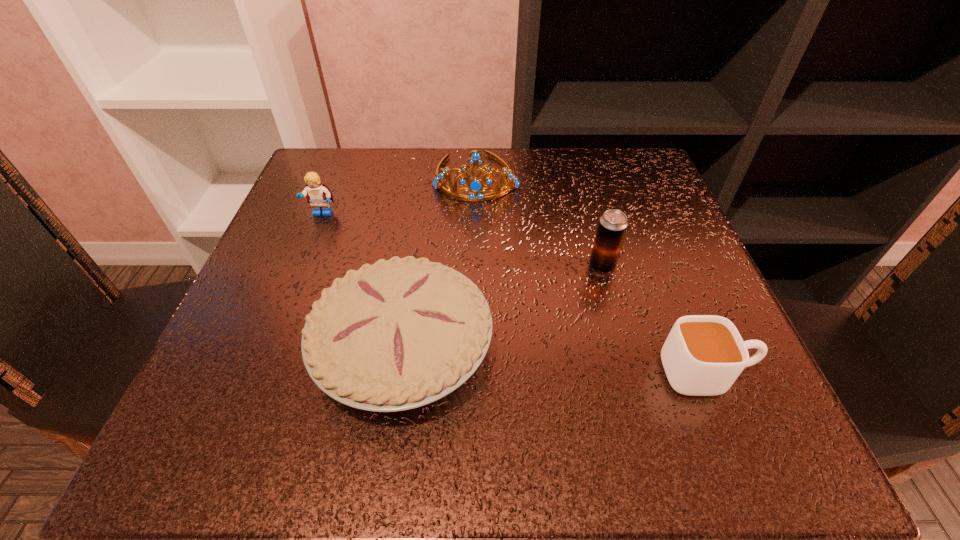
Where is `vacant space that's between the third nearest object and the farthest object`? This screenshot has width=960, height=540. vacant space that's between the third nearest object and the farthest object is located at coordinates (540, 221).

This screenshot has width=960, height=540. I want to click on vacant space that's between the farthest object and the third nearest object, so click(x=540, y=221).

Where is `free space that is in between the third farthest object and the Lego`? free space that is in between the third farthest object and the Lego is located at coordinates (462, 240).

Identify which object is the fourth nearest to the farthest object. Please provide its 2D coordinates. Your answer should be formatted as a tuple, i.e. [(x, y)], where the tuple contains the x and y coordinates of a point satisfying the conditions above.

[(703, 355)]

The height and width of the screenshot is (540, 960). I want to click on object that is the fourth closest to the farthest object, so click(x=703, y=355).

Locate an element on the screen. Image resolution: width=960 pixels, height=540 pixels. vacant area that satisfies the following two spatial constraints: 1. on the front-facing side of the tiara; 2. on the left side of the beer can is located at coordinates (475, 266).

Locate an element on the screen. Image resolution: width=960 pixels, height=540 pixels. free space that satisfies the following two spatial constraints: 1. on the front-facing side of the third nearest object; 2. on the right side of the farthest object is located at coordinates (475, 266).

Identify the location of vacant point that satisfies the following two spatial constraints: 1. on the front-facing side of the fourth nearest object; 2. on the left side of the beer can. (301, 266).

What are the coordinates of `blank space that satisfies the following two spatial constraints: 1. on the front-facing side of the fourth object from left to right; 2. on the right side of the Lego` in the screenshot? It's located at (301, 266).